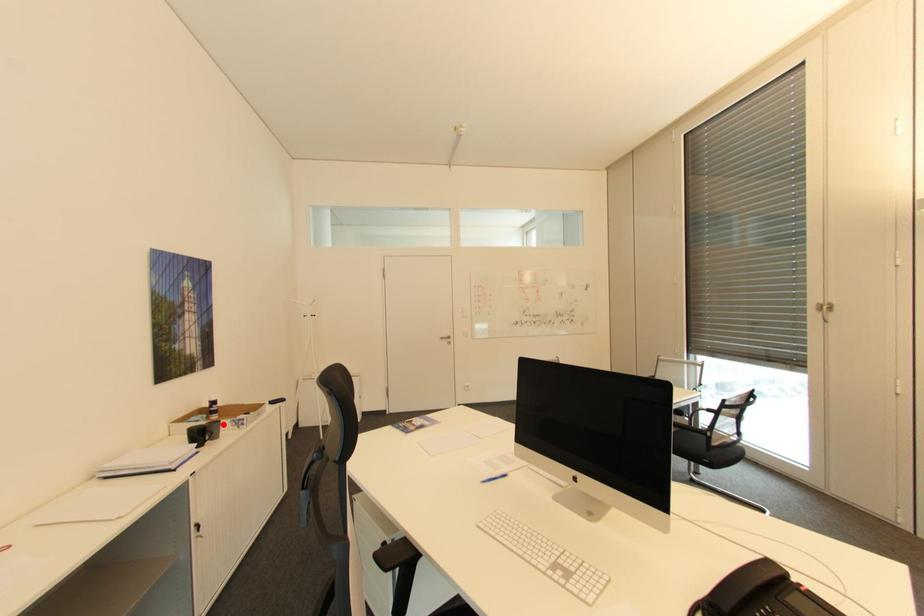
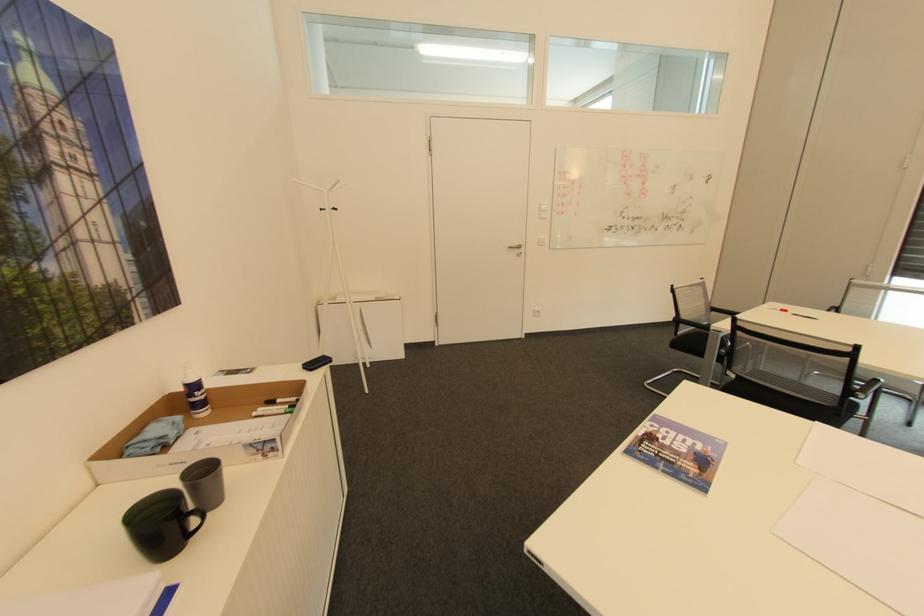
Find the pixel in the second image that matches the highlighted location in the first image.

(222, 477)